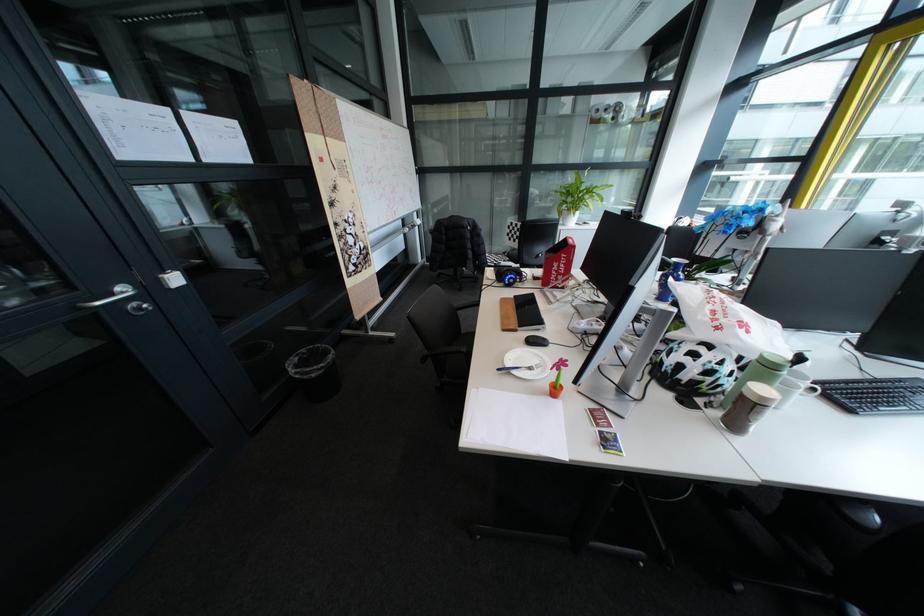
Which object does [758,374] point to?

It corresponds to the green travel mug in the image.